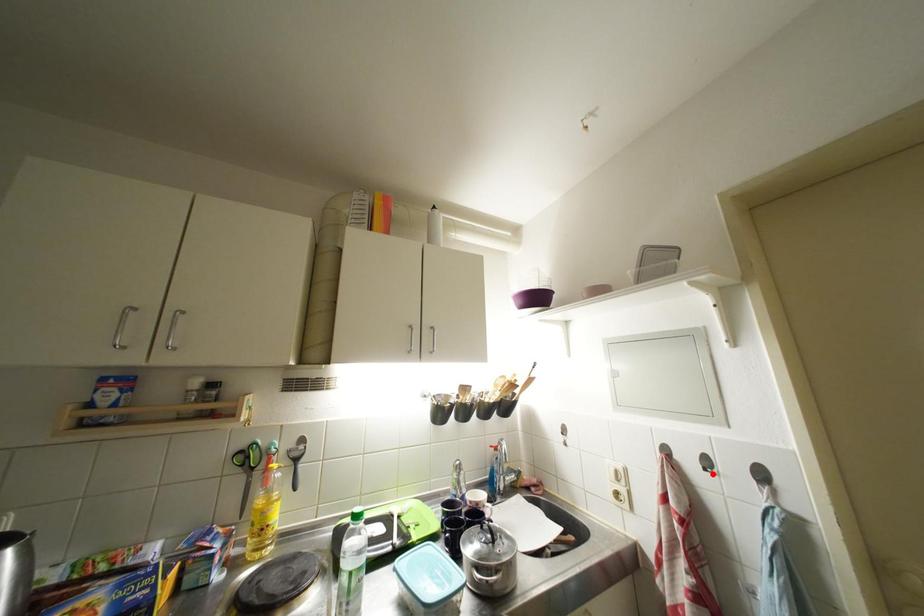
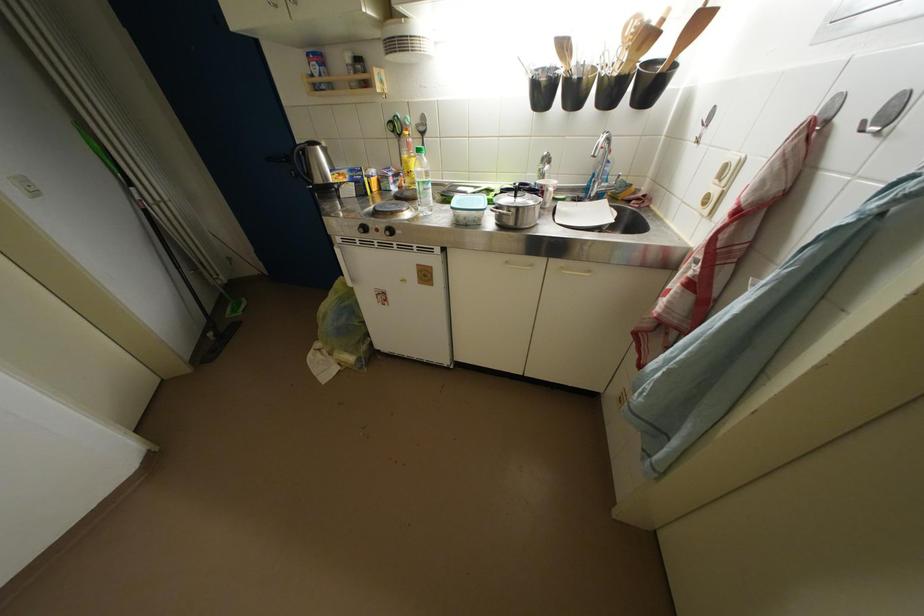
Where in the second image is the point corresponding to the highlighted location from the first image?

(869, 132)